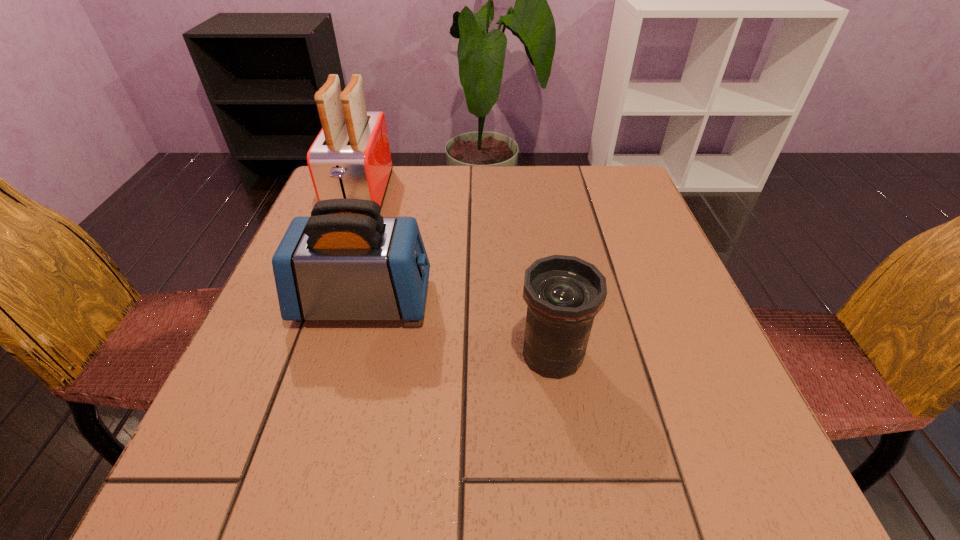
The width and height of the screenshot is (960, 540). Identify the location of the farthest object. (350, 158).

Locate an element on the screen. The height and width of the screenshot is (540, 960). the farther toaster is located at coordinates (350, 158).

This screenshot has width=960, height=540. In order to click on the nearer toaster in this screenshot , I will do `click(346, 262)`.

Identify the location of the second tallest object. (346, 262).

Where is `the shortest object`? The image size is (960, 540). the shortest object is located at coordinates (563, 294).

You are a GUI agent. You are given a task and a screenshot of the screen. Output one action in this format:
    pyautogui.click(x=<x>, y=<y>)
    Task: Click on the telephoto lens
    This screenshot has height=540, width=960.
    Given the screenshot: What is the action you would take?
    pyautogui.click(x=563, y=294)

You are a GUI agent. You are given a task and a screenshot of the screen. Output one action in this format:
    pyautogui.click(x=<x>, y=<y>)
    Task: Click on the vacant position located 0.170m on the front-facing side of the taller toaster
    The height and width of the screenshot is (540, 960).
    Given the screenshot: What is the action you would take?
    pyautogui.click(x=331, y=276)

Where is `vacant space located on the front-facing side of the nearer toaster`? vacant space located on the front-facing side of the nearer toaster is located at coordinates (547, 301).

Where is `free region located on the left of the telephoto lens`? free region located on the left of the telephoto lens is located at coordinates (287, 354).

Where is `object positioned at the far edge`? object positioned at the far edge is located at coordinates (350, 158).